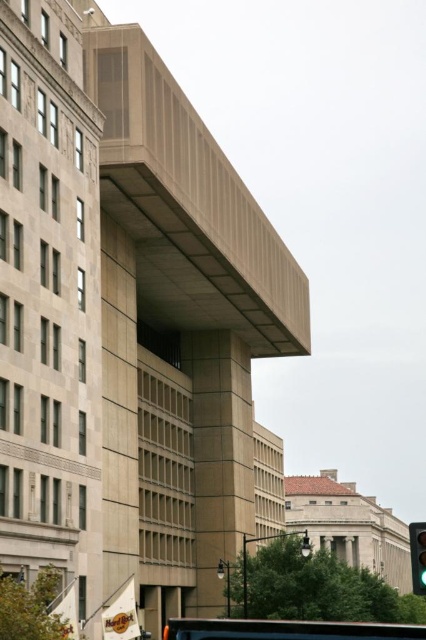
Can you confirm if metallic silver bus at center is thinner than green glass traffic light at lower right?

No, metallic silver bus at center is not thinner than green glass traffic light at lower right.

Can you confirm if metallic silver bus at center is bigger than green glass traffic light at lower right?

Yes, metallic silver bus at center is bigger than green glass traffic light at lower right.

This screenshot has width=426, height=640. What are the coordinates of `metallic silver bus at center` in the screenshot? It's located at (287, 628).